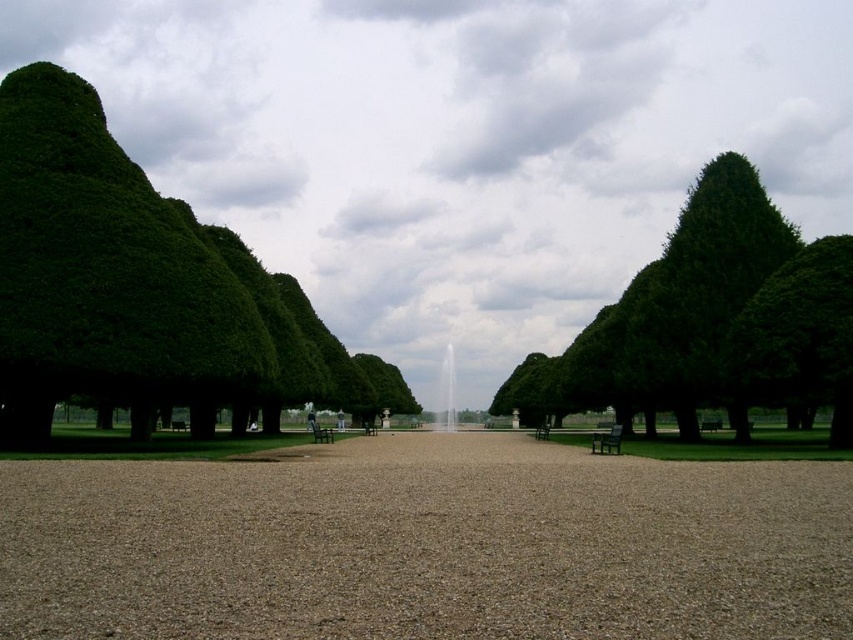
Who is more distant from viewer, [152,192] or [325,442]?

Positioned behind is point [325,442].

Can you confirm if green leafy tree at left is positioned to the left of dark gray wooden bench at center?

Correct, you'll find green leafy tree at left to the left of dark gray wooden bench at center.

The image size is (853, 640). What do you see at coordinates (143, 289) in the screenshot?
I see `green leafy tree at left` at bounding box center [143, 289].

This screenshot has height=640, width=853. I want to click on green leafy tree at left, so click(x=143, y=289).

Does brown gravel at center appear over dark gray wooden bench at center?

Yes, brown gravel at center is above dark gray wooden bench at center.

Does brown gravel at center appear on the left side of dark gray wooden bench at center?

No, brown gravel at center is not to the left of dark gray wooden bench at center.

The height and width of the screenshot is (640, 853). What do you see at coordinates (426, 545) in the screenshot?
I see `brown gravel at center` at bounding box center [426, 545].

Where is `brown gravel at center`? brown gravel at center is located at coordinates (426, 545).

Does brown gravel at center appear over green textured tree at right?

No.

Is point (567, 618) positioned before point (834, 332)?

Yes, point (567, 618) is closer to viewer.

Find the location of a particular element. brown gravel at center is located at coordinates (426, 545).